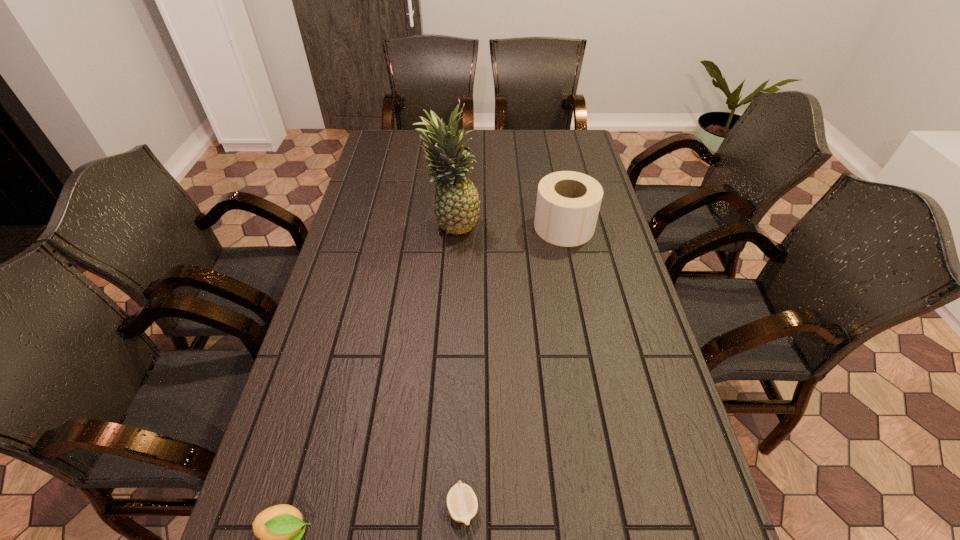
You are a GUI agent. You are given a task and a screenshot of the screen. Output one action in this format:
    pyautogui.click(x=<x>, y=<y>)
    Task: Click on the free spot at the left edge of the desktop
    
    Given the screenshot: What is the action you would take?
    pyautogui.click(x=379, y=218)

Image resolution: width=960 pixels, height=540 pixels. In order to click on free space at the right edge in this screenshot , I will do `click(661, 454)`.

In the image, there is a desktop. At what (x,y) coordinates should I click in order to perform the action: click on free space at the far right corner. Please return your answer as a coordinate pair (x, y). Looking at the image, I should click on (588, 145).

The image size is (960, 540). Identify the location of unoccupied position between the third shortest object and the pineapple. (508, 226).

The width and height of the screenshot is (960, 540). I want to click on empty location between the toilet tissue and the shorter lemon, so click(514, 367).

Image resolution: width=960 pixels, height=540 pixels. I want to click on free point between the pineapple and the third shortest object, so click(x=508, y=226).

Where is `free space between the tallest object and the shortest object`? The width and height of the screenshot is (960, 540). free space between the tallest object and the shortest object is located at coordinates (457, 366).

This screenshot has width=960, height=540. Find the location of `free space between the shorter lemon and the toilet tissue`. free space between the shorter lemon and the toilet tissue is located at coordinates (514, 367).

Identify which object is the closest to the right lemon. Please provide its 2D coordinates. Your answer should be formatted as a tuple, i.e. [(x, y)], where the tuple contains the x and y coordinates of a point satisfying the conditions above.

[(278, 527)]

Find the location of `the third closest object to the left lemon`. the third closest object to the left lemon is located at coordinates (568, 203).